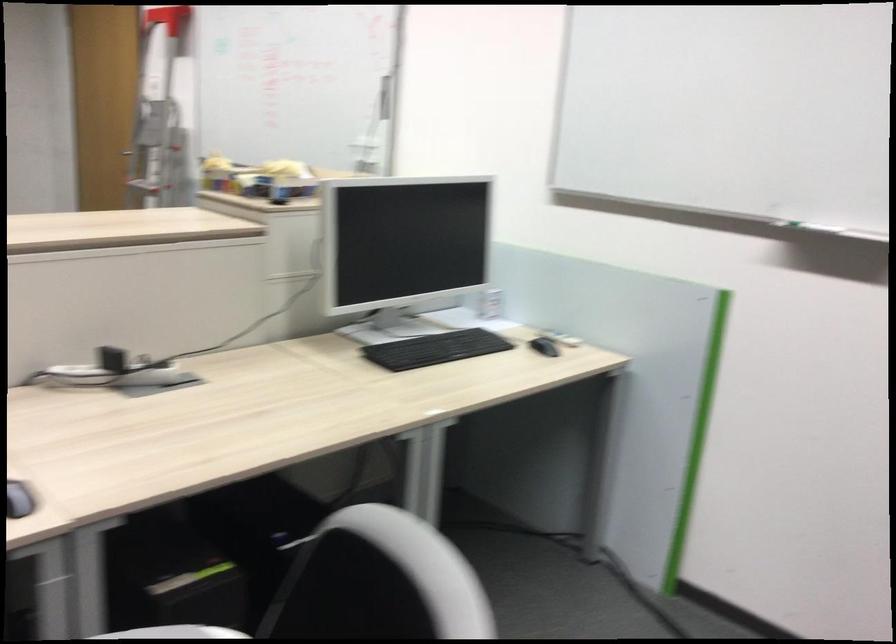
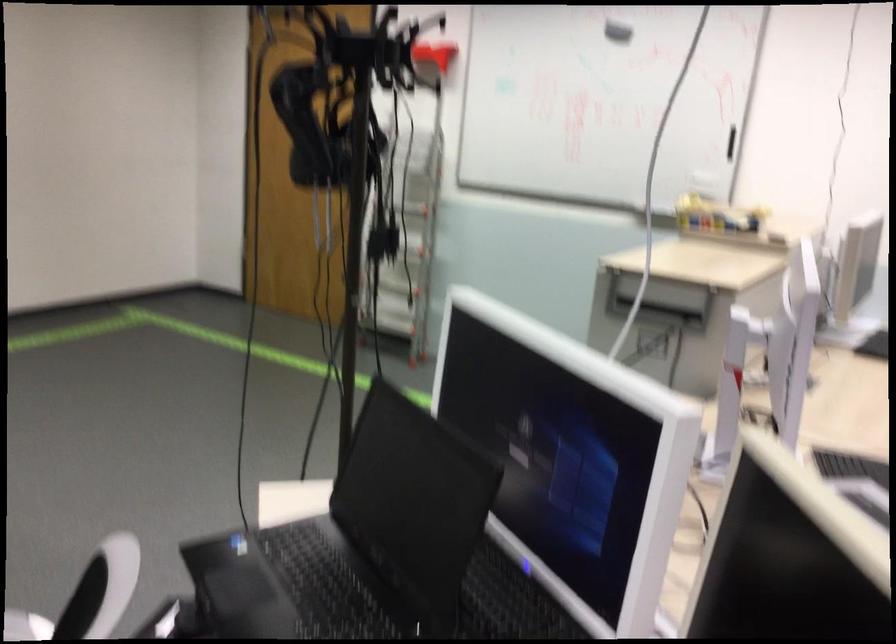
Question: Which direction would the cameraman need to move to produce the second image? Reply with the corresponding letter.

Choices:
 (A) Left
 (B) Right
 (C) Forward
 (D) Backward

Answer: (A)